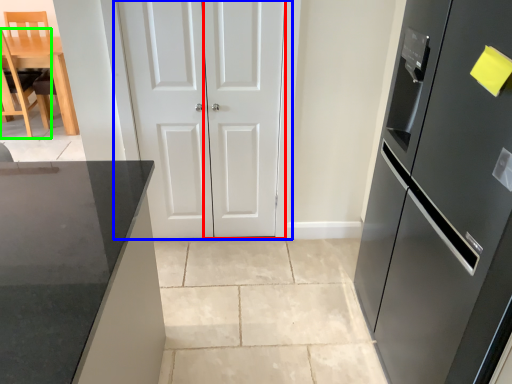
Question: Based on their relative distances, which object is farther from door (highlighted by a red box)? Choose from door (highlighted by a blue box) and chair (highlighted by a green box).

Choices:
 (A) door
 (B) chair

Answer: (B)